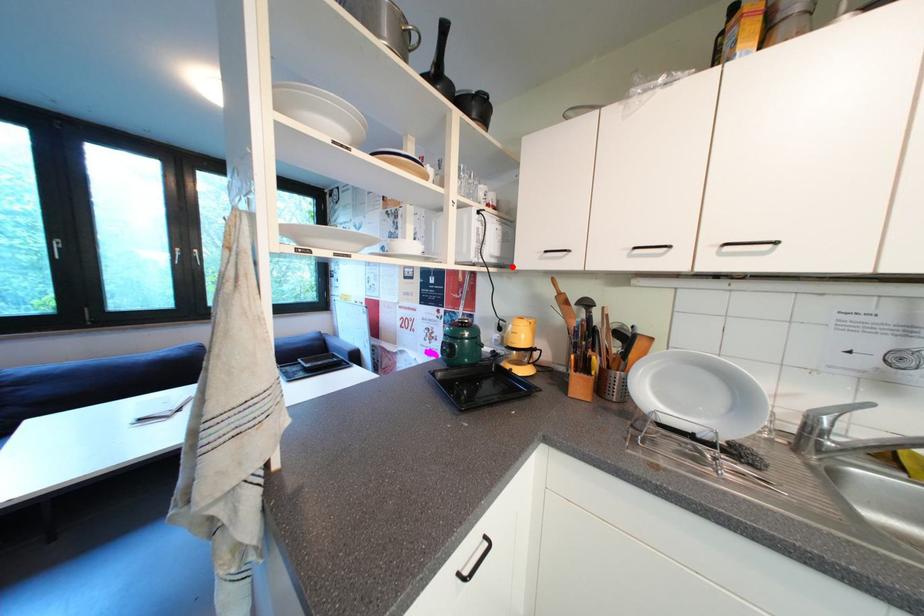
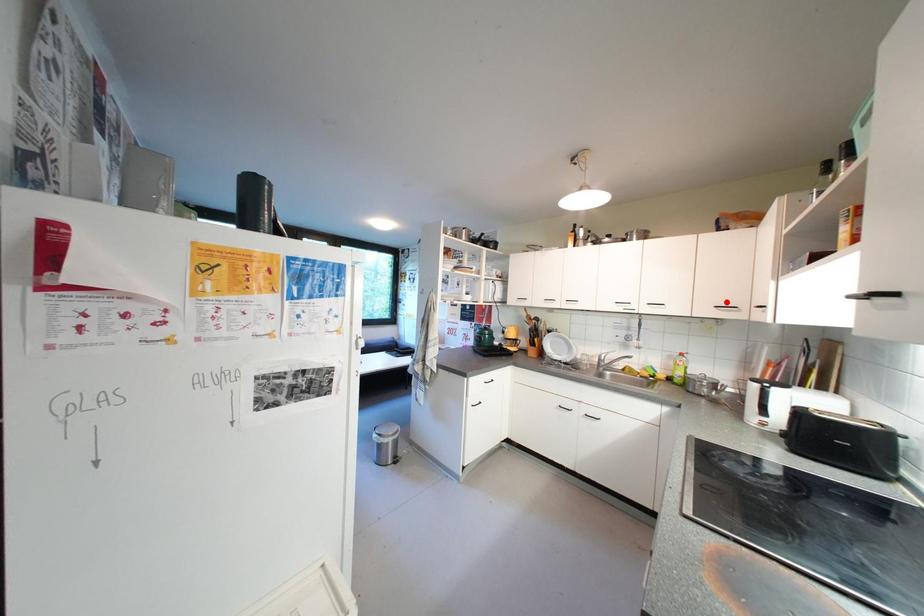
I am providing you with two images of the same scene from different viewpoints. A red point is marked on the first image and another point is marked on the second image. Do the highlighted points in image1 and image2 indicate the same real-world spot?

No